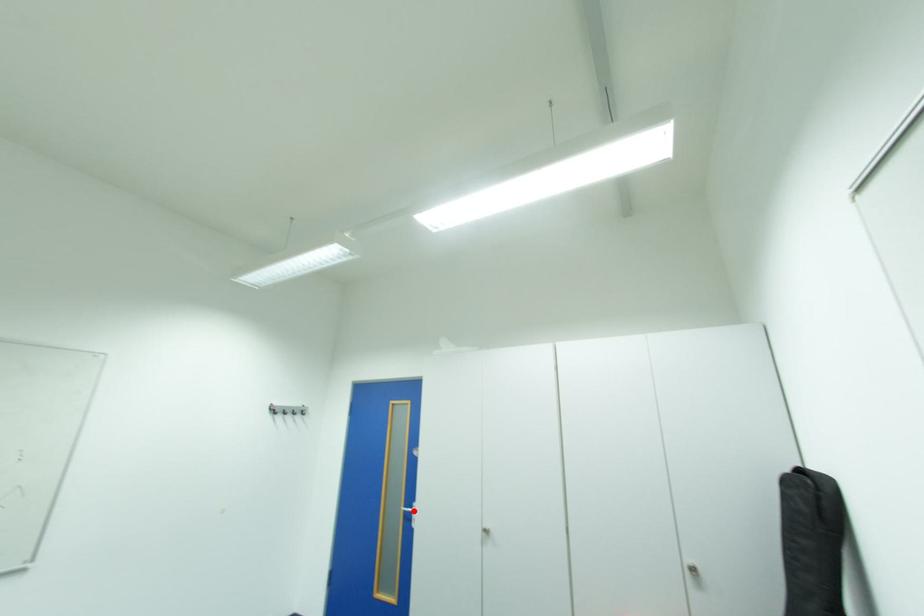
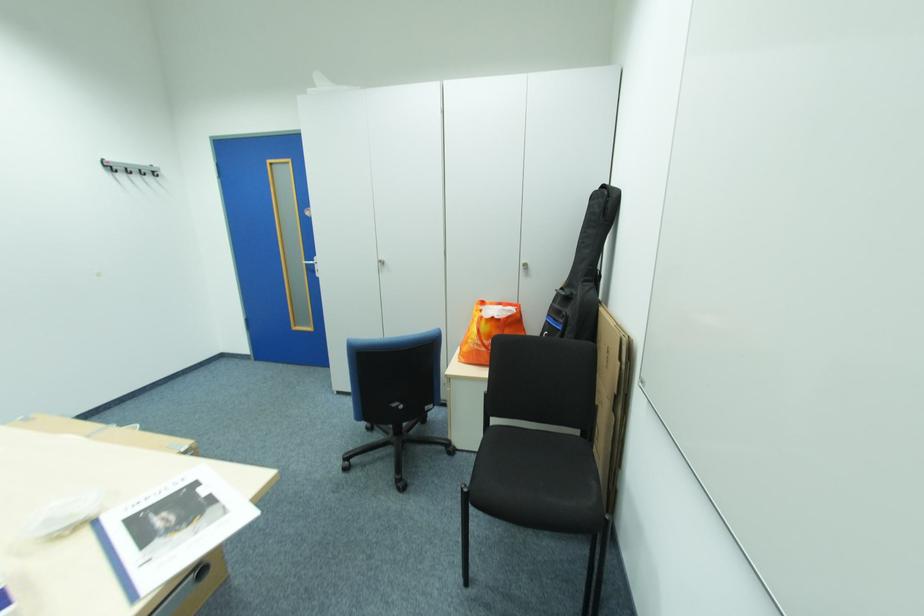
Question: I am providing you with two images of the same scene from different viewpoints. Image1 has a red point marked. In image2, the corresponding 3D location appears at what relative position? Reply with the corresponding letter.

Choices:
 (A) Closer
 (B) Farther

Answer: (A)